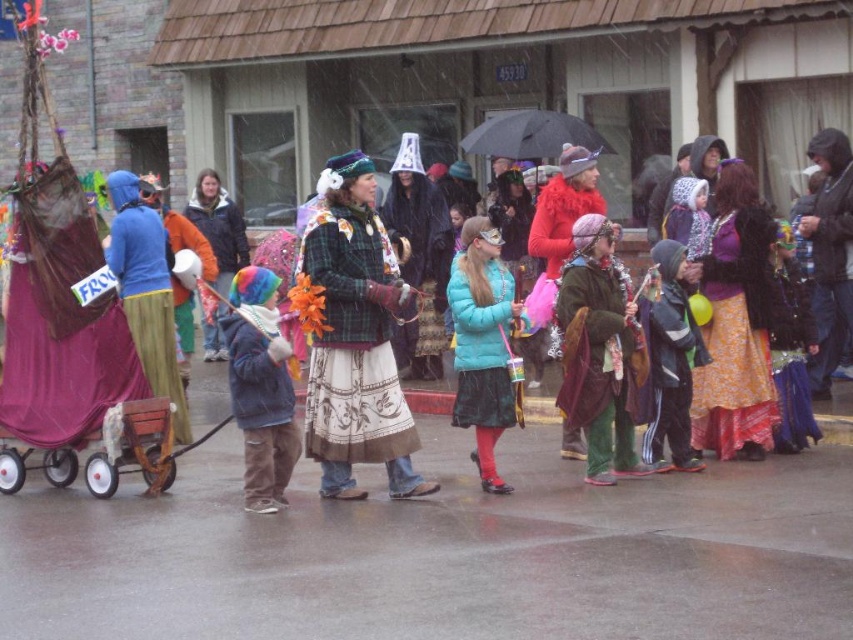
Between blue fuzzy hat at left and orange fleece jacket at center, which one appears on the right side from the viewer's perspective?

Positioned to the right is blue fuzzy hat at left.

I want to click on blue fuzzy hat at left, so point(146,291).

Between point (165, 340) and point (228, 196), which one is positioned behind?

Point (228, 196)

Identify the location of blue fuzzy hat at left. (146, 291).

Is blue fuzzy hat at left shorter than matte purple fabric at left?

Incorrect, blue fuzzy hat at left's height does not fall short of matte purple fabric at left's.

Can you confirm if blue fuzzy hat at left is positioned above matte purple fabric at left?

Yes, blue fuzzy hat at left is above matte purple fabric at left.

Is point (115, 246) farther from viewer compared to point (213, 428)?

That is True.

The width and height of the screenshot is (853, 640). I want to click on blue fuzzy hat at left, so click(x=146, y=291).

Is point (260, 342) more distant than point (677, 467)?

No, (260, 342) is closer to viewer.

From the picture: Is denim jacket at center positioned behind dark gray fleece jacket at center?

No.

Who is more forward, (289,346) or (671,308)?

Point (671,308)

The image size is (853, 640). I want to click on denim jacket at center, so click(x=260, y=387).